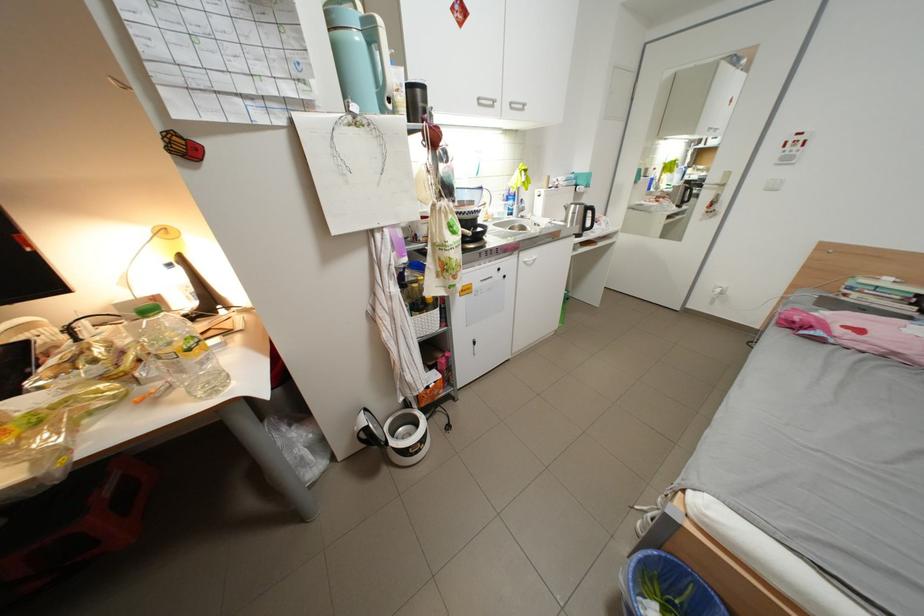
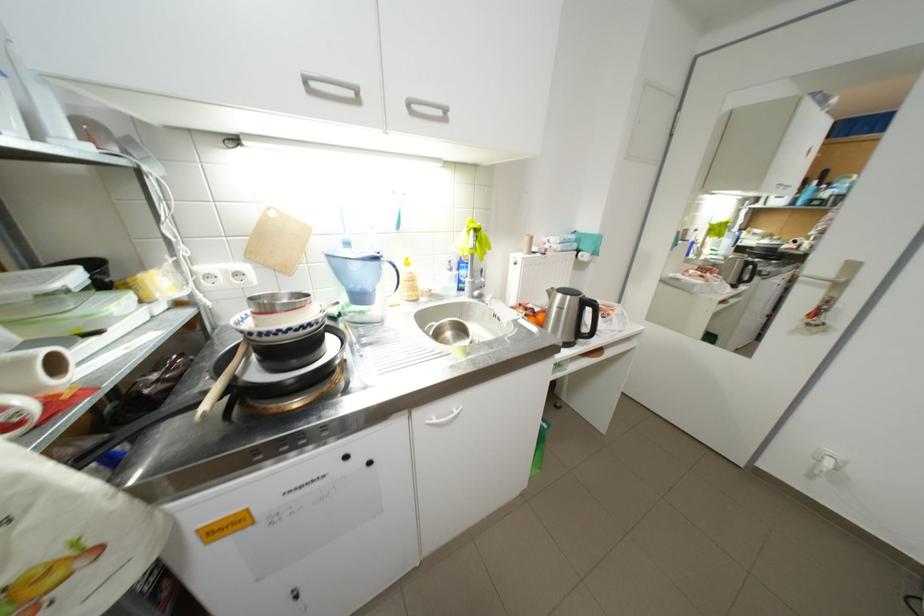
In the second image, find the point that corresponds to the point at 523,105 in the first image.

(420, 105)